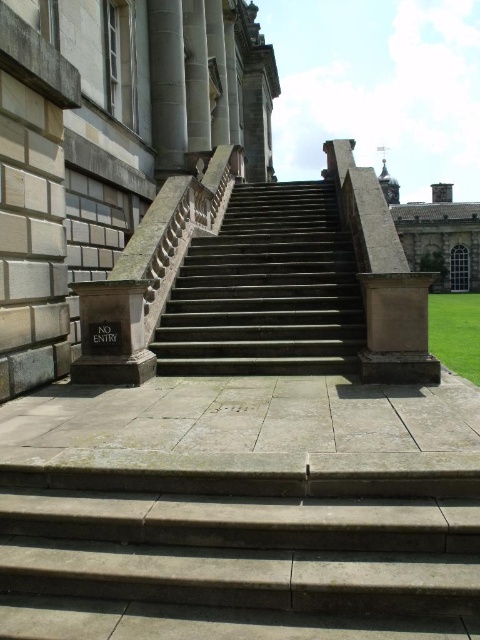
From the picture: You are standing at the bottom of the grand staircase and want to go up to the building entrance. The point marked at coordinates [237,554] is part of the structure. Which object does this point belong to?

The point at [237,554] belongs to the gray stone stairs at lower center.

You are an architect examining the building facade. You need to install a decorative light on the taller structure between the sandy stone pillar at center and the slate gray stone column at upper left. Which structure should you choose?

The sandy stone pillar at center is taller than the slate gray stone column at upper left, so you should install the decorative light on the sandy stone pillar at center.

You are standing at the bottom of the grand staircase and want to climb up to the building entrance. There are two sets of stairs in front of you. The gray stone stairs at lower center and the dark gray stone stairs at center. Which set of stairs should you take to reach the entrance?

You should take the gray stone stairs at lower center because they are larger in size than the dark gray stone stairs at center, making them more likely to be the main staircase leading to the entrance.